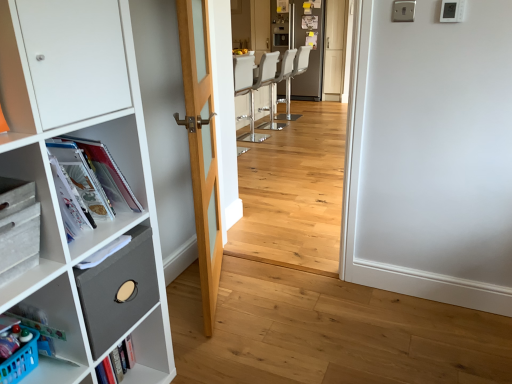
Question: Based on their sizes in the image, would you say white leather bar stool at center, acting as the 2th armchair starting from the front, is bigger or smaller than natural wood door at center?

Choices:
 (A) big
 (B) small

Answer: (A)

Question: Considering the positions of white leather bar stool at center, acting as the 2th armchair starting from the front, and natural wood door at center in the image, is white leather bar stool at center, acting as the 2th armchair starting from the front, taller or shorter than natural wood door at center?

Choices:
 (A) short
 (B) tall

Answer: (A)

Question: Which object is the farthest from the white leather bar stool at center, acting as the 2th armchair starting from the front?

Choices:
 (A) natural wood door at center
 (B) matte plastic magazines at left
 (C) light wood floor at center
 (D) matte gray drawer at left
 (E) white glossy refrigerator at upper center

Answer: (D)

Question: Based on their relative distances, which object is nearer to the white leather bar stool at center, acting as the 2th armchair starting from the front?

Choices:
 (A) matte gray drawer at left
 (B) white glossy refrigerator at upper center
 (C) light wood floor at center
 (D) white leather barstool at center, the first armchair viewed from the front
 (E) matte plastic magazines at left

Answer: (D)